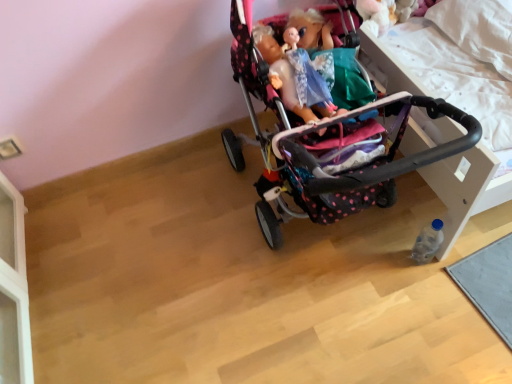
You are a GUI agent. You are given a task and a screenshot of the screen. Output one action in this format:
    pyautogui.click(x=<x>, y=<y>)
    Task: Click on the free space behind clear plastic bottle at lower right
    This screenshot has width=512, height=384.
    Given the screenshot: What is the action you would take?
    pyautogui.click(x=401, y=220)